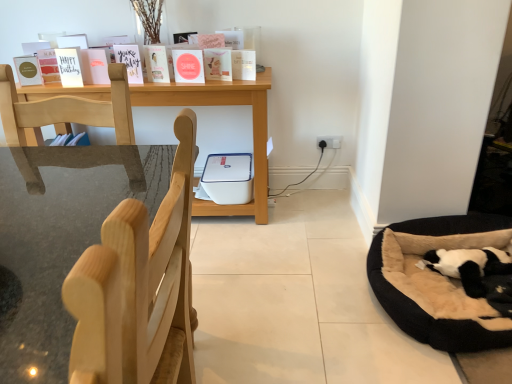
Question: Is there a large distance between white matte paperback book at upper center, the 1th paperback book viewed from the right, and black plush dog bed at lower right?

Choices:
 (A) yes
 (B) no

Answer: (A)

Question: From the image's perspective, is white matte paperback book at upper center, positioned as the 8th paperback book in left-to-right order, over black plush dog bed at lower right?

Choices:
 (A) yes
 (B) no

Answer: (A)

Question: Does white matte paperback book at upper center, positioned as the 8th paperback book in left-to-right order, contain black plush dog bed at lower right?

Choices:
 (A) yes
 (B) no

Answer: (B)

Question: Does white matte paperback book at upper center, the 1th paperback book viewed from the right, appear on the left side of black plush dog bed at lower right?

Choices:
 (A) no
 (B) yes

Answer: (B)

Question: Is white matte paperback book at upper center, the 1th paperback book viewed from the right, shorter than black plush dog bed at lower right?

Choices:
 (A) yes
 (B) no

Answer: (A)

Question: Considering the positions of point (501, 263) and point (159, 71), is point (501, 263) closer or farther from the camera than point (159, 71)?

Choices:
 (A) closer
 (B) farther

Answer: (A)

Question: Looking at their shapes, would you say black plush dog bed at lower right is wider or thinner than matte white paperback book at center, positioned as the fifth paperback book in left-to-right order?

Choices:
 (A) wide
 (B) thin

Answer: (A)

Question: Is black plush dog bed at lower right inside or outside of matte white paperback book at center, which appears as the 4th paperback book when viewed from the right?

Choices:
 (A) outside
 (B) inside

Answer: (A)

Question: Considering the positions of black plush dog bed at lower right and matte white paperback book at center, positioned as the fifth paperback book in left-to-right order, in the image, is black plush dog bed at lower right taller or shorter than matte white paperback book at center, positioned as the fifth paperback book in left-to-right order,?

Choices:
 (A) short
 (B) tall

Answer: (A)

Question: Looking at their shapes, would you say white matte card at upper left, which is the 7th paperback book from right to left, is wider or thinner than matte green paperback book at left, marked as the eighth paperback book in a right-to-left arrangement?

Choices:
 (A) thin
 (B) wide

Answer: (B)

Question: Is white matte card at upper left, which is the 7th paperback book from right to left, to the left or to the right of matte green paperback book at left, the 1th paperback book viewed from the left, in the image?

Choices:
 (A) left
 (B) right

Answer: (B)

Question: Is white matte card at upper left, the second paperback book viewed from the left, inside the boundaries of matte green paperback book at left, marked as the eighth paperback book in a right-to-left arrangement, or outside?

Choices:
 (A) outside
 (B) inside

Answer: (A)

Question: From the image's perspective, is white matte card at upper left, which is the 7th paperback book from right to left, above or below matte green paperback book at left, the 1th paperback book viewed from the left?

Choices:
 (A) above
 (B) below

Answer: (A)

Question: From a real-world perspective, is white matte card at upper left, which is the 7th paperback book from right to left, positioned above or below black plush dog bed at lower right?

Choices:
 (A) below
 (B) above

Answer: (B)

Question: Is white matte card at upper left, which is the 7th paperback book from right to left, wider or thinner than black plush dog bed at lower right?

Choices:
 (A) thin
 (B) wide

Answer: (A)